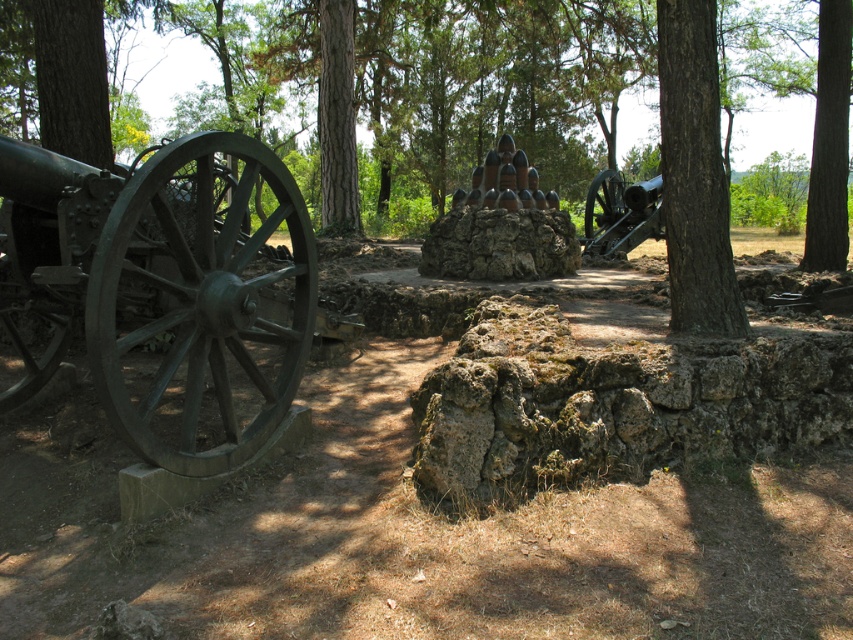
Who is more distant from viewer, (717, 52) or (614, 176)?

The point (614, 176) is more distant.

Does brown rough bark tree at right have a greater height compared to green metal cannon at right?

Correct, brown rough bark tree at right is much taller as green metal cannon at right.

Is point (677, 24) less distant than point (608, 208)?

That is True.

Find the location of a particular element. Image resolution: width=853 pixels, height=640 pixels. brown rough bark tree at right is located at coordinates (694, 173).

Who is higher up, green metal cannon at left or brown rough bark tree at right?

green metal cannon at left is above.

Between point (28, 376) and point (660, 61), which one is positioned behind?

Point (28, 376)

Is point (9, 358) closer to camera compared to point (670, 198)?

No.

Find the location of `green metal cannon at left`. green metal cannon at left is located at coordinates (163, 291).

Which of these two, green metal cannon at left or green rough bark tree at center, stands shorter?

green metal cannon at left

Who is more distant from viewer, (233, 337) or (815, 250)?

The point (815, 250) is behind.

Which is in front, point (39, 384) or point (836, 54)?

Positioned in front is point (39, 384).

Image resolution: width=853 pixels, height=640 pixels. Identify the location of green metal cannon at left. [x=163, y=291].